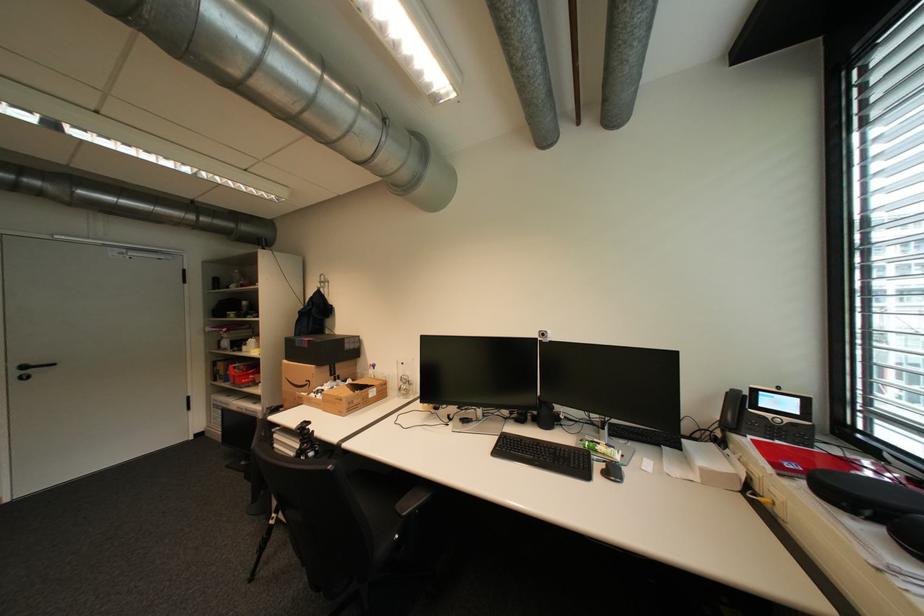
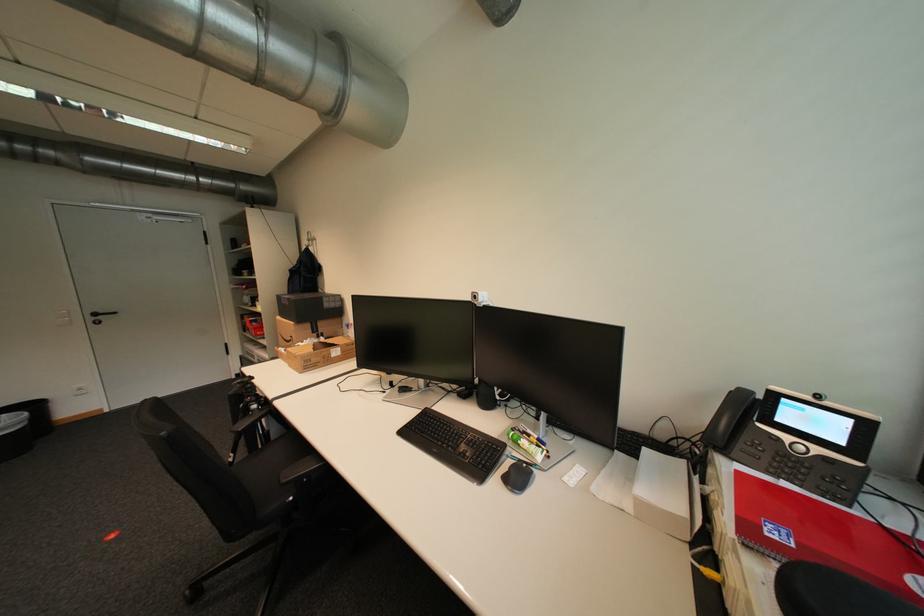
Where in the second image is the point corresponding to [317,451] from the first image?

(261, 403)